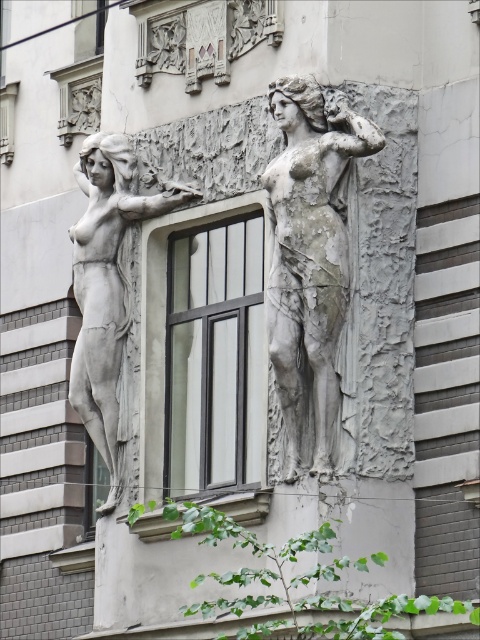
Question: From the image, what is the correct spatial relationship of black glass window at center in relation to stone statue at center?

Choices:
 (A) above
 (B) below

Answer: (B)

Question: Does black glass window at center lie in front of stone statue at center?

Choices:
 (A) yes
 (B) no

Answer: (B)

Question: Among these points, which one is farthest from the camera?

Choices:
 (A) pos(274,314)
 (B) pos(132,208)

Answer: (B)

Question: Estimate the real-world distances between objects in this image. Which object is farther from the matte gray statue at left?

Choices:
 (A) stone statue at center
 (B) black glass window at center

Answer: (A)

Question: Which object is farther from the camera taking this photo?

Choices:
 (A) stone statue at center
 (B) matte gray statue at left

Answer: (B)

Question: Does stone statue at center have a larger size compared to matte gray statue at left?

Choices:
 (A) no
 (B) yes

Answer: (A)